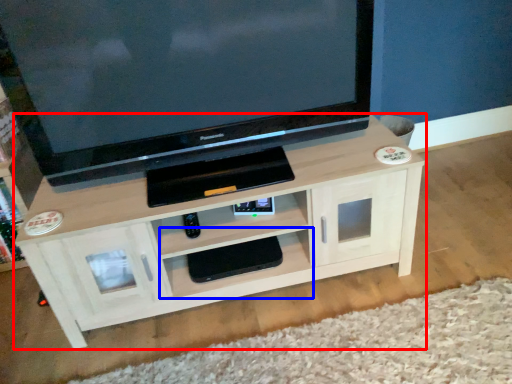
Question: Which object is closer to the camera taking this photo, shelf (highlighted by a red box) or shelf (highlighted by a blue box)?

Choices:
 (A) shelf
 (B) shelf

Answer: (A)